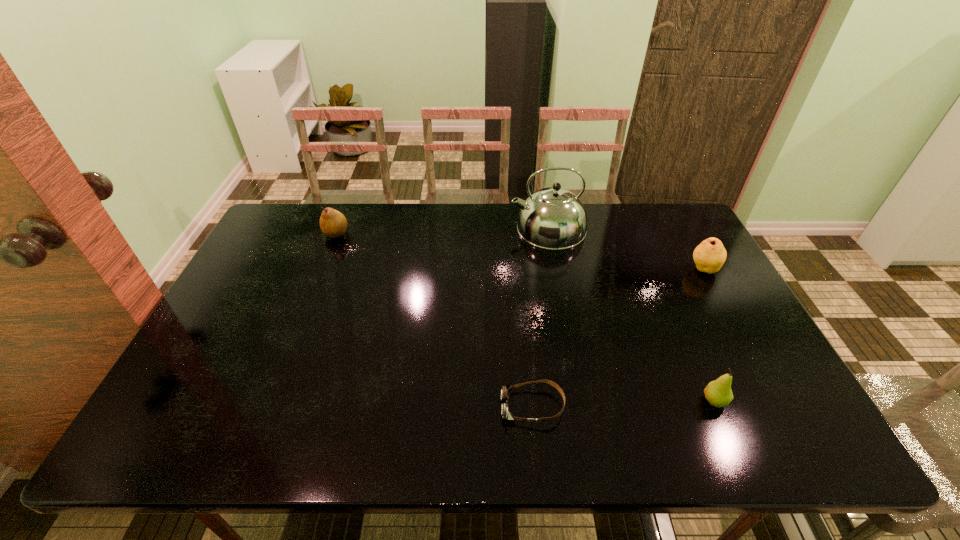
The image size is (960, 540). In order to click on vacant space at the far edge of the desktop in this screenshot , I will do click(638, 217).

The image size is (960, 540). In order to click on vacant space at the near edge of the desktop in this screenshot , I will do `click(536, 417)`.

Image resolution: width=960 pixels, height=540 pixels. Identify the location of vacant area at the left edge. [252, 342].

The image size is (960, 540). What are the coordinates of `vacant space at the right edge of the desktop` in the screenshot? It's located at (762, 346).

I want to click on vacant space at the far left corner of the desktop, so click(x=303, y=218).

The image size is (960, 540). I want to click on free space at the far right corner of the desktop, so click(659, 234).

Where is `free space between the nearest pear and the kettle`? free space between the nearest pear and the kettle is located at coordinates (631, 314).

The height and width of the screenshot is (540, 960). In order to click on vacant area that lies between the leftmost pear and the tallest object in this screenshot , I will do `click(442, 231)`.

The image size is (960, 540). I want to click on free space between the leftmost pear and the goggles, so click(x=434, y=320).

Locate an element on the screen. The image size is (960, 540). free point between the farthest pear and the tallest object is located at coordinates (442, 231).